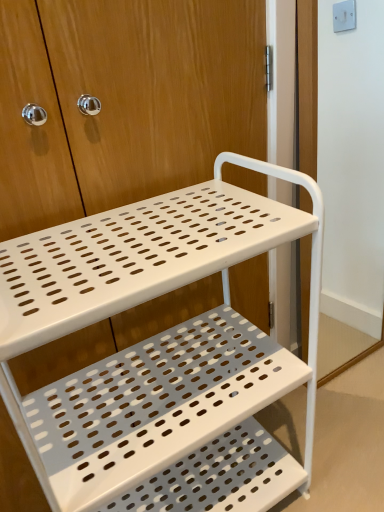
This screenshot has height=512, width=384. I want to click on white perforated metal cart at center, so click(x=158, y=352).

In order to face white perforated metal cart at center, should I rotate leftwards or rightwards?

Turn left by 3.533 degrees to look at white perforated metal cart at center.

The height and width of the screenshot is (512, 384). What do you see at coordinates (158, 352) in the screenshot?
I see `white perforated metal cart at center` at bounding box center [158, 352].

Identify the location of white matte screen door at right. The height and width of the screenshot is (512, 384). (307, 84).

What do you see at coordinates (307, 84) in the screenshot?
I see `white matte screen door at right` at bounding box center [307, 84].

Measure the distance between point (334, 373) and camera.

Point (334, 373) is 5.06 feet away from camera.

This screenshot has width=384, height=512. Find the location of `white perforated metal cart at center`. white perforated metal cart at center is located at coordinates (158, 352).

Considering the relative positions of white perforated metal cart at center and white matte screen door at right in the image provided, is white perforated metal cart at center to the right of white matte screen door at right from the viewer's perspective?

In fact, white perforated metal cart at center is to the left of white matte screen door at right.

Does white perforated metal cart at center come in front of white matte screen door at right?

Yes.

Is point (131, 367) less distant than point (307, 5)?

That is False.

From the image's perspective, between white perforated metal cart at center and white matte screen door at right, which one is located above?

white matte screen door at right is shown above in the image.

From a real-world perspective, between white perforated metal cart at center and white matte screen door at right, who is vertically lower?

white perforated metal cart at center.

Between white perforated metal cart at center and white matte screen door at right, which one has larger width?

white perforated metal cart at center.

Does white perforated metal cart at center have a lesser height compared to white matte screen door at right?

Yes.

Considering the sizes of objects white perforated metal cart at center and white matte screen door at right in the image provided, who is bigger, white perforated metal cart at center or white matte screen door at right?

Bigger between the two is white perforated metal cart at center.

Is white perforated metal cart at center outside of white matte screen door at right?

That's correct, white perforated metal cart at center is outside of white matte screen door at right.

Is white perforated metal cart at center with white matte screen door at right?

No.

Could you tell me if white perforated metal cart at center is turned towards white matte screen door at right?

No, white perforated metal cart at center is not aimed at white matte screen door at right.

Measure the distance from white perforated metal cart at center to white matte screen door at right.

white perforated metal cart at center is 20.80 inches away from white matte screen door at right.

Locate an element on the screen. The width and height of the screenshot is (384, 512). furniture located below the white matte screen door at right (from the image's perspective) is located at coordinates (158, 352).

Which is more to the right, white matte screen door at right or white perforated metal cart at center?

Positioned to the right is white matte screen door at right.

Which object is closer to the camera, white matte screen door at right or white perforated metal cart at center?

white perforated metal cart at center is more forward.

Does point (306, 196) come behind point (92, 390)?

Yes, it is behind point (92, 390).

From the image's perspective, which object appears higher, white matte screen door at right or white perforated metal cart at center?

white matte screen door at right.

From a real-world perspective, is white matte screen door at right physically above white perforated metal cart at center?

Correct, in the physical world, white matte screen door at right is higher than white perforated metal cart at center.

Considering the relative sizes of white matte screen door at right and white perforated metal cart at center in the image provided, is white matte screen door at right thinner than white perforated metal cart at center?

Correct, the width of white matte screen door at right is less than that of white perforated metal cart at center.

From their relative heights in the image, would you say white matte screen door at right is taller or shorter than white perforated metal cart at center?

white matte screen door at right is taller than white perforated metal cart at center.

Is white matte screen door at right bigger or smaller than white perforated metal cart at center?

Clearly, white matte screen door at right is smaller in size than white perforated metal cart at center.

Looking at this image, can we say white matte screen door at right lies outside white perforated metal cart at center?

Yes.

Is white matte screen door at right not close to white perforated metal cart at center?

Actually, white matte screen door at right and white perforated metal cart at center are a little close together.

Does white matte screen door at right turn towards white perforated metal cart at center?

No, white matte screen door at right is not oriented towards white perforated metal cart at center.

What's the angular difference between white matte screen door at right and white perforated metal cart at center's facing directions?

1.01 degrees.

This screenshot has width=384, height=512. Identify the location of screen door that is on the right side of white perforated metal cart at center. (307, 84).

Image resolution: width=384 pixels, height=512 pixels. What are the coordinates of `screen door above the white perforated metal cart at center (from a real-world perspective)` in the screenshot? It's located at (307, 84).

Image resolution: width=384 pixels, height=512 pixels. Find the location of `screen door that is on the right side of white perforated metal cart at center`. screen door that is on the right side of white perforated metal cart at center is located at coordinates click(x=307, y=84).